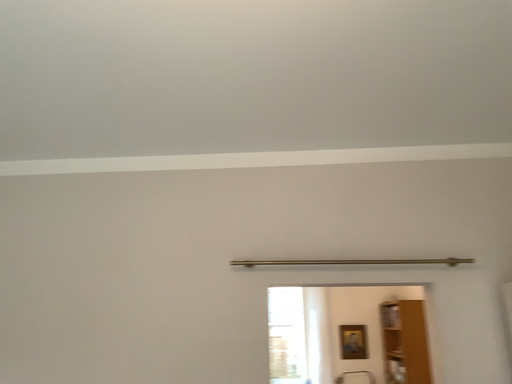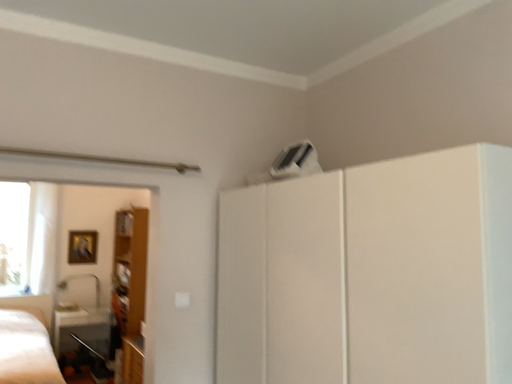
Question: How did the camera likely rotate when shooting the video?

Choices:
 (A) rotated right
 (B) rotated left

Answer: (A)